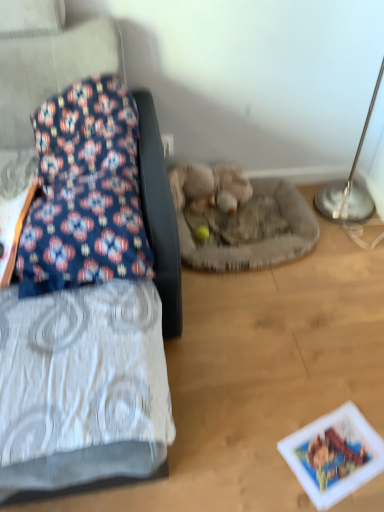
Locate an element on the screen. The height and width of the screenshot is (512, 384). vacant space that's between fuzzy beige stuffed animal at center and printed paper postcard at lower right is located at coordinates (277, 333).